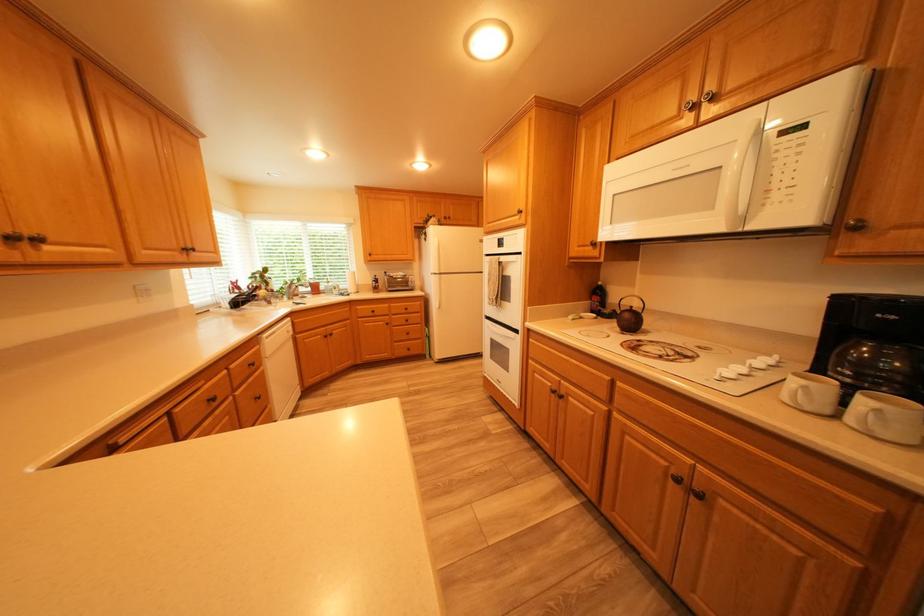
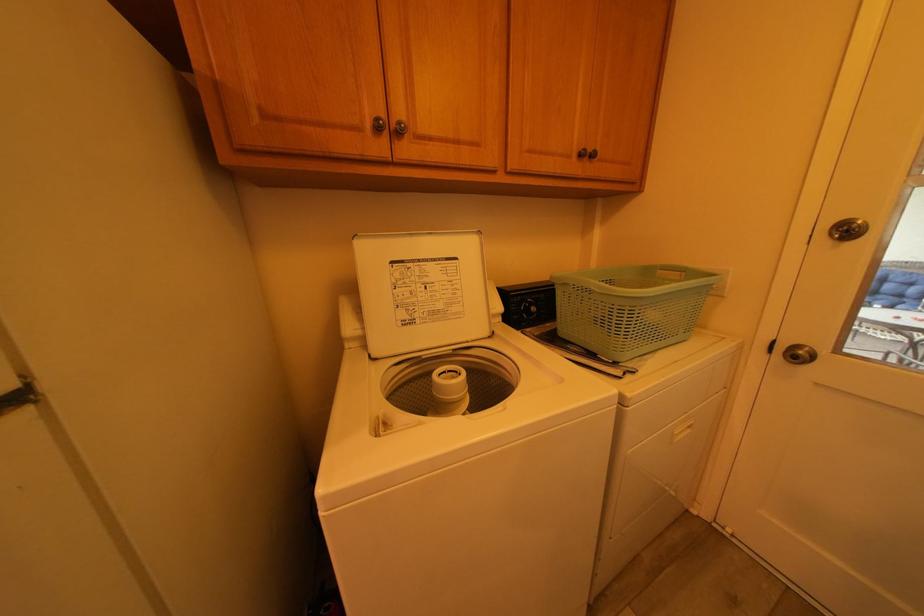
Question: What movement of the cameraman would produce the second image?

Choices:
 (A) Left
 (B) Right
 (C) Forward
 (D) Backward

Answer: (C)